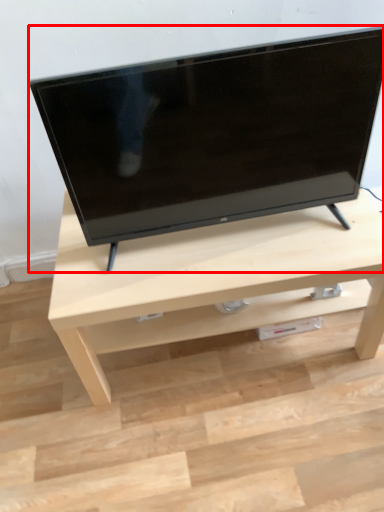
Question: From the image, what is the correct spatial relationship of television (annotated by the red box) in relation to table?

Choices:
 (A) right
 (B) left

Answer: (B)